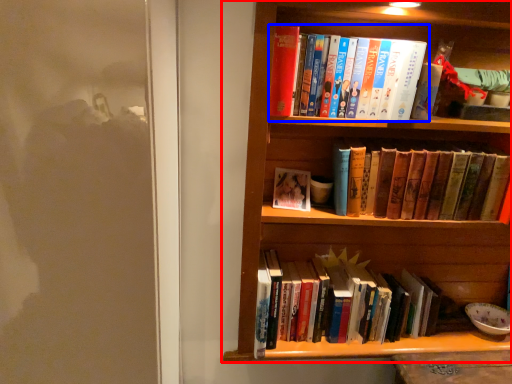
Question: Which point is further to the camera, bookcase (highlighted by a red box) or book (highlighted by a blue box)?

Choices:
 (A) bookcase
 (B) book

Answer: (B)